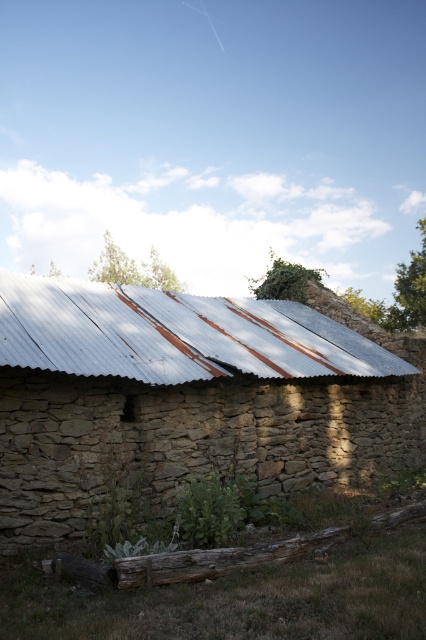
Question: Based on their relative distances, which object is nearer to the rusty wood log at lower center?

Choices:
 (A) rusty metal roof at center
 (B) rusty metal barn at center

Answer: (A)

Question: Can you confirm if rusty metal barn at center is wider than rusty wood log at lower center?

Choices:
 (A) yes
 (B) no

Answer: (B)

Question: Which object is positioned closest to the rusty metal roof at center?

Choices:
 (A) rusty metal barn at center
 (B) rusty wood log at lower center

Answer: (A)

Question: Does rusty metal roof at center have a greater width compared to rusty wood log at lower center?

Choices:
 (A) no
 (B) yes

Answer: (A)

Question: Which point is closer to the camera?

Choices:
 (A) (129, 372)
 (B) (423, 500)

Answer: (A)

Question: From the image, what is the correct spatial relationship of rusty metal barn at center in relation to rusty wood log at lower center?

Choices:
 (A) left
 (B) right

Answer: (A)